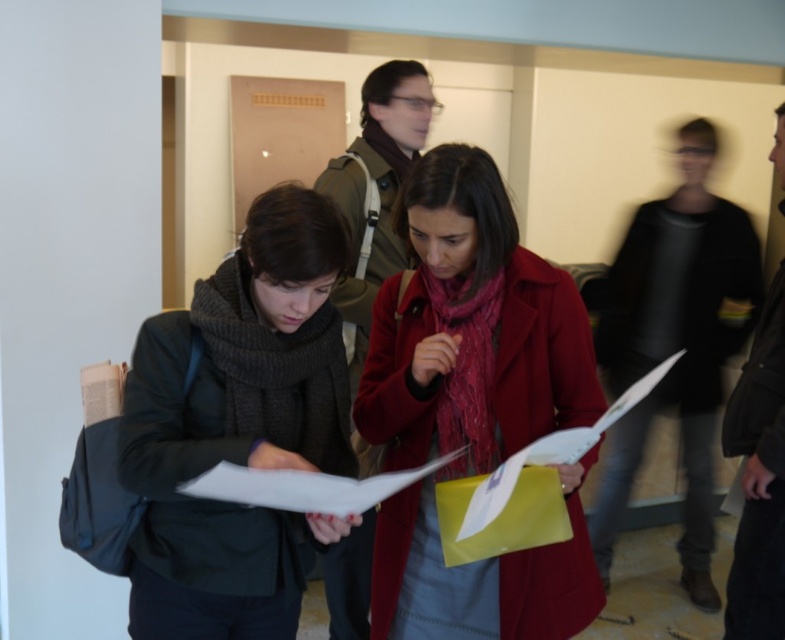
Question: Which of the following is the farthest from the observer?

Choices:
 (A) knitted wool scarf at left
 (B) matte brown jacket at center
 (C) matte red coat at center

Answer: (B)

Question: Which of the following is the closest to the observer?

Choices:
 (A) (769, 445)
 (B) (608, 484)
 (C) (363, 323)
 (D) (334, 380)

Answer: (D)

Question: Does knitted wool scarf at left appear on the left side of dark gray sweater at right?

Choices:
 (A) yes
 (B) no

Answer: (A)

Question: Can you confirm if knitted wool scarf at left is positioned below matte brown jacket at center?

Choices:
 (A) no
 (B) yes

Answer: (B)

Question: Can you confirm if dark gray sweater at right is positioned to the right of dark gray jacket at right?

Choices:
 (A) no
 (B) yes

Answer: (B)

Question: Which object appears closest to the camera in this image?

Choices:
 (A) knitted wool scarf at left
 (B) matte brown jacket at center

Answer: (A)